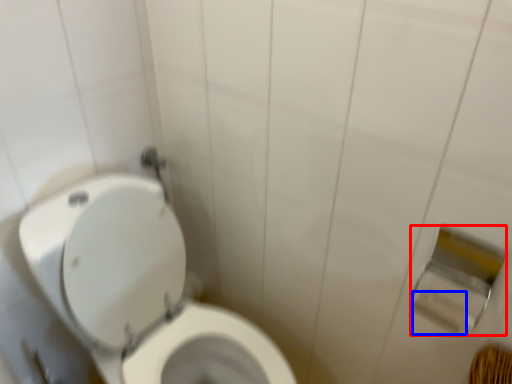
Question: Which of the following is the closest to the observer, toilet paper (highlighted by a red box) or toilet paper (highlighted by a blue box)?

Choices:
 (A) toilet paper
 (B) toilet paper

Answer: (A)